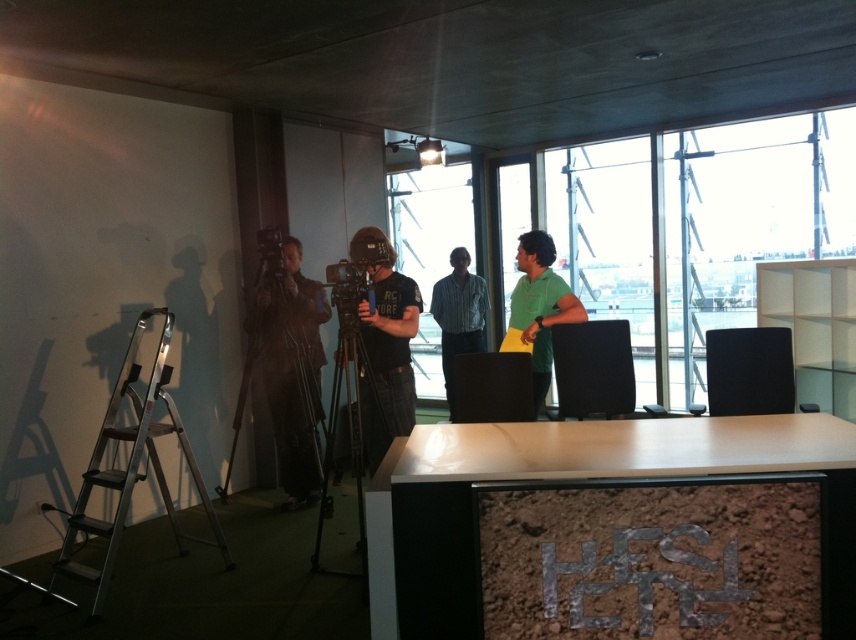
Question: Which point is closer to the camera?

Choices:
 (A) (532, 339)
 (B) (473, 332)
 (C) (260, 296)

Answer: (A)

Question: Estimate the real-world distances between objects in this image. Which object is farther from the silver metallic ladder at left?

Choices:
 (A) black cotton t-shirt at center
 (B) striped shirt at center
 (C) dark brown leather jacket at left

Answer: (B)

Question: Does dark brown leather jacket at left have a smaller size compared to black cotton t-shirt at center?

Choices:
 (A) no
 (B) yes

Answer: (B)

Question: Does green matte shirt at center lie in front of striped shirt at center?

Choices:
 (A) yes
 (B) no

Answer: (A)

Question: Which object is positioned farthest from the black cotton t-shirt at center?

Choices:
 (A) dark brown leather jacket at left
 (B) green matte shirt at center

Answer: (A)

Question: From the image, what is the correct spatial relationship of silver metallic ladder at left in relation to dark brown leather jacket at left?

Choices:
 (A) above
 (B) below

Answer: (B)